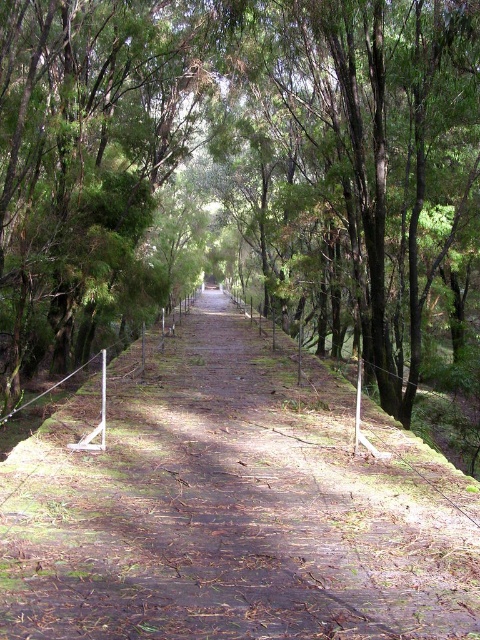
Question: Observing the image, what is the correct spatial positioning of green leafy tree at center in reference to dirt path at center?

Choices:
 (A) right
 (B) left

Answer: (A)

Question: Does green leafy tree at center lie behind dirt path at center?

Choices:
 (A) yes
 (B) no

Answer: (A)

Question: Which object appears farthest from the camera in this image?

Choices:
 (A) green leafy tree at center
 (B) dirt path at center

Answer: (A)

Question: Is green leafy tree at center wider than dirt path at center?

Choices:
 (A) no
 (B) yes

Answer: (B)